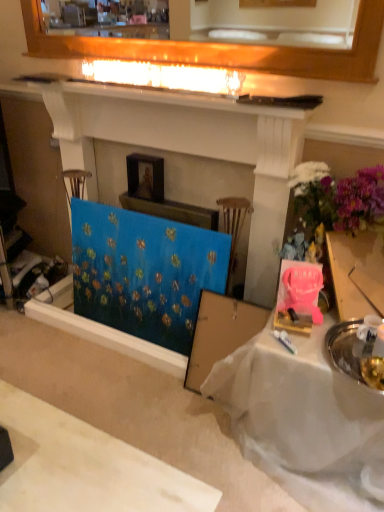
Question: From the image's perspective, relative to blue fabric painting at center, is white cloth-covered table at lower right above or below?

Choices:
 (A) below
 (B) above

Answer: (A)

Question: Is white cloth-covered table at lower right to the left or to the right of blue fabric painting at center in the image?

Choices:
 (A) right
 (B) left

Answer: (A)

Question: Which object is positioned closest to the blue fabric painting at center?

Choices:
 (A) white glossy mantle at upper center
 (B) white cloth-covered table at lower right
 (C) blue canvas at center
 (D) wooden picture frame at upper center

Answer: (C)

Question: Which object is positioned farthest from the wooden picture frame at upper center?

Choices:
 (A) blue fabric painting at center
 (B) white glossy mantle at upper center
 (C) blue canvas at center
 (D) white cloth-covered table at lower right

Answer: (D)